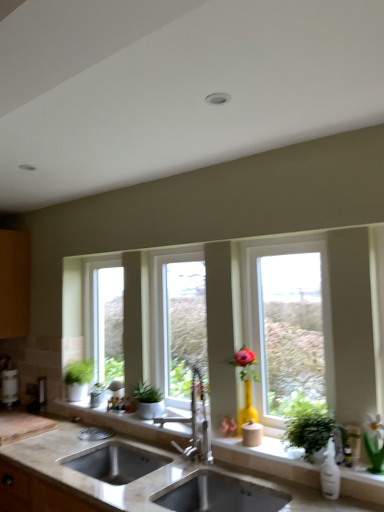
Question: Is satin nickel faucet at center smaller than clear glass window at center, which appears as the 3th window when viewed from the right?

Choices:
 (A) no
 (B) yes

Answer: (B)

Question: Is satin nickel faucet at center positioned beyond the bounds of clear glass window at center, which appears as the 3th window when viewed from the right?

Choices:
 (A) no
 (B) yes

Answer: (B)

Question: Is satin nickel faucet at center at the right side of clear glass window at center, which appears as the 3th window when viewed from the right?

Choices:
 (A) no
 (B) yes

Answer: (B)

Question: Is satin nickel faucet at center turned away from clear glass window at center, acting as the 3th window starting from the front?

Choices:
 (A) yes
 (B) no

Answer: (B)

Question: Can you confirm if satin nickel faucet at center is thinner than clear glass window at center, which appears as the 3th window when viewed from the right?

Choices:
 (A) yes
 (B) no

Answer: (B)

Question: From a real-world perspective, relative to clear glass window at center, acting as the 3th window starting from the front, is green matte plant at left, the third houseplant in the front-to-back sequence, vertically above or below?

Choices:
 (A) below
 (B) above

Answer: (A)

Question: Is green matte plant at left, the 4th houseplant positioned from the right, bigger or smaller than clear glass window at center, which is the 1th window from back to front?

Choices:
 (A) small
 (B) big

Answer: (A)

Question: Is point (77, 376) closer or farther from the camera than point (110, 339)?

Choices:
 (A) farther
 (B) closer

Answer: (B)

Question: Considering the positions of green matte plant at left, which is the 2th houseplant in back-to-front order, and clear glass window at center, positioned as the 1th window in left-to-right order, in the image, is green matte plant at left, which is the 2th houseplant in back-to-front order, taller or shorter than clear glass window at center, positioned as the 1th window in left-to-right order,?

Choices:
 (A) short
 (B) tall

Answer: (A)

Question: Is point coord(142,384) closer or farther from the camera than point coord(117,342)?

Choices:
 (A) closer
 (B) farther

Answer: (A)

Question: From a real-world perspective, is green matte plant at center, the third houseplant in the back-to-front sequence, physically located above or below clear glass window at center, which appears as the 3th window when viewed from the right?

Choices:
 (A) below
 (B) above

Answer: (A)

Question: In terms of width, does green matte plant at center, positioned as the 3th houseplant in left-to-right order, look wider or thinner when compared to clear glass window at center, acting as the 3th window starting from the front?

Choices:
 (A) thin
 (B) wide

Answer: (B)

Question: From the image's perspective, is green matte plant at center, placed as the 2th houseplant when sorted from right to left, above or below clear glass window at center, which appears as the 3th window when viewed from the right?

Choices:
 (A) above
 (B) below

Answer: (B)

Question: Is satin nickel faucet at center bigger or smaller than clear glass window at center, the first window positioned from the right?

Choices:
 (A) small
 (B) big

Answer: (A)

Question: From the image's perspective, is satin nickel faucet at center located above or below clear glass window at center, the first window positioned from the right?

Choices:
 (A) below
 (B) above

Answer: (A)